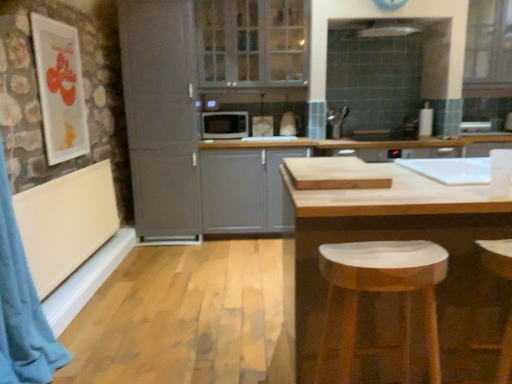
Question: Considering the positions of point (206, 218) and point (399, 289), is point (206, 218) closer or farther from the camera than point (399, 289)?

Choices:
 (A) farther
 (B) closer

Answer: (A)

Question: Is matte gray cabinet at center, positioned as the first cabinetry in right-to-left order, wider or thinner than white marble stool at lower right?

Choices:
 (A) wide
 (B) thin

Answer: (A)

Question: Which of these objects is positioned closest to the matte gray cabinet at center, the second cabinetry from the left?

Choices:
 (A) blue fabric curtain at left
 (B) white marble stool at lower right
 (C) natural wood table at center
 (D) matte gray cabinet at left, which ranks as the 2th cabinetry in right-to-left order
 (E) clear glass cabinet at upper center, the 2th window positioned from the right

Answer: (D)

Question: Estimate the real-world distances between objects in this image. Which object is closer to the white marble stool at lower right?

Choices:
 (A) matte gray cabinet at left, which ranks as the 2th cabinetry in right-to-left order
 (B) clear glass window at upper right, marked as the first window in a right-to-left arrangement
 (C) natural wood table at center
 (D) blue fabric curtain at left
 (E) matte white picture frame at upper left

Answer: (C)